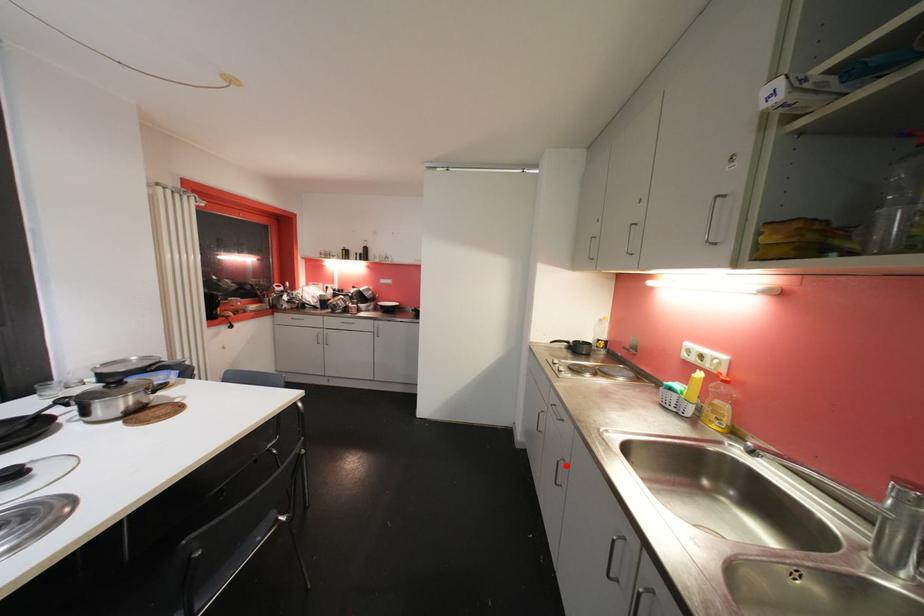
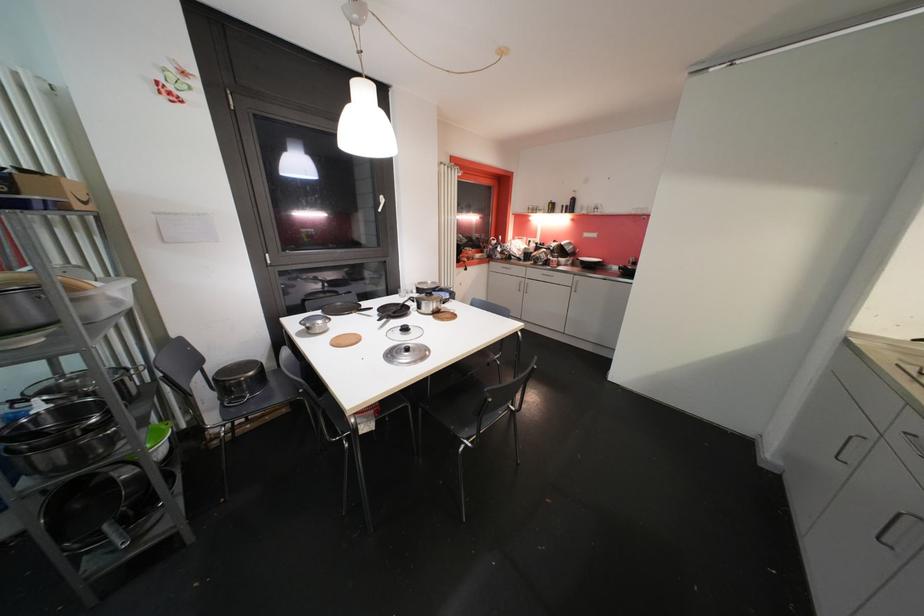
Question: I am providing you with two images of the same scene from different viewpoints. Image1 has a red point marked. In image2, the corresponding 3D location appears at what relative position? Reply with the corresponding letter.

Choices:
 (A) Closer
 (B) Farther

Answer: (B)